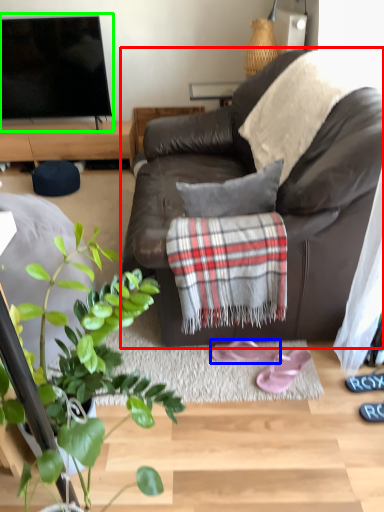
Question: Based on their relative distances, which object is farther from studio couch (highlighted by a red box)? Choose from footwear (highlighted by a blue box) and television (highlighted by a green box).

Choices:
 (A) footwear
 (B) television

Answer: (B)